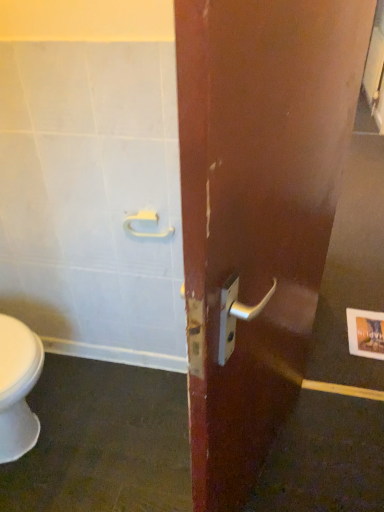
You are a GUI agent. You are given a task and a screenshot of the screen. Output one action in this format:
    pyautogui.click(x=<x>, y=<y>)
    Task: Click on the vacant space to the right of matte brown door at center
    This screenshot has height=512, width=384.
    Given the screenshot: What is the action you would take?
    pyautogui.click(x=327, y=458)